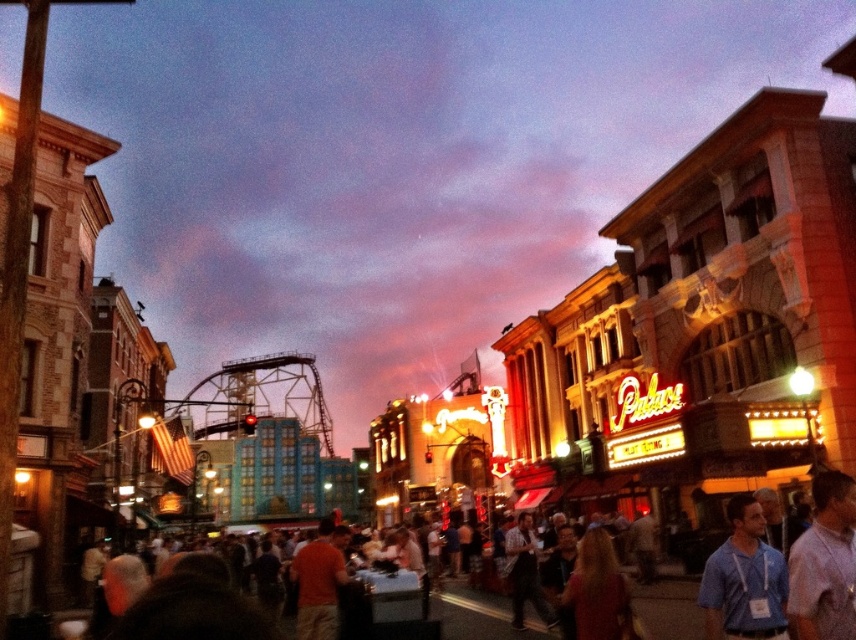
Is point (742, 513) positioned before point (688, 602)?

Yes, it is.

This screenshot has height=640, width=856. Describe the element at coordinates (744, 579) in the screenshot. I see `blue fabric shirt at center` at that location.

Identify the location of blue fabric shirt at center. The width and height of the screenshot is (856, 640). (744, 579).